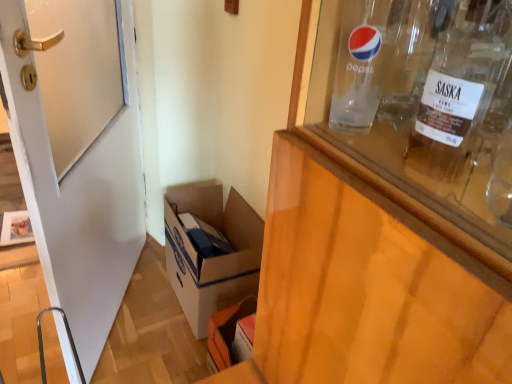
Question: Can you confirm if clear glass bottle at upper right is taller than white cardboard box at lower left?

Choices:
 (A) yes
 (B) no

Answer: (B)

Question: Considering the relative sizes of clear glass bottle at upper right and white cardboard box at lower left in the image provided, is clear glass bottle at upper right bigger than white cardboard box at lower left?

Choices:
 (A) no
 (B) yes

Answer: (A)

Question: Is white cardboard box at lower left located within clear glass bottle at upper right?

Choices:
 (A) no
 (B) yes

Answer: (A)

Question: From a real-world perspective, is clear glass bottle at upper right positioned over white cardboard box at lower left based on gravity?

Choices:
 (A) yes
 (B) no

Answer: (A)

Question: Does clear glass bottle at upper right turn towards white cardboard box at lower left?

Choices:
 (A) no
 (B) yes

Answer: (A)

Question: Does clear glass bottle at upper right appear on the left side of white cardboard box at lower left?

Choices:
 (A) yes
 (B) no

Answer: (B)

Question: Can you confirm if transparent glass bottle at upper right is positioned to the left of clear glass bottle at upper right?

Choices:
 (A) no
 (B) yes

Answer: (A)

Question: Is transparent glass bottle at upper right positioned in front of clear glass bottle at upper right?

Choices:
 (A) no
 (B) yes

Answer: (B)

Question: From the image's perspective, does transparent glass bottle at upper right appear higher than clear glass bottle at upper right?

Choices:
 (A) no
 (B) yes

Answer: (A)

Question: Can we say transparent glass bottle at upper right lies outside clear glass bottle at upper right?

Choices:
 (A) yes
 (B) no

Answer: (A)

Question: Is clear glass bottle at upper right surrounded by transparent glass bottle at upper right?

Choices:
 (A) no
 (B) yes

Answer: (A)

Question: Considering the relative sizes of transparent glass bottle at upper right and clear glass bottle at upper right in the image provided, is transparent glass bottle at upper right shorter than clear glass bottle at upper right?

Choices:
 (A) yes
 (B) no

Answer: (A)

Question: Can you confirm if clear glass bottle at upper right is shorter than transparent glass bottle at upper right?

Choices:
 (A) no
 (B) yes

Answer: (A)